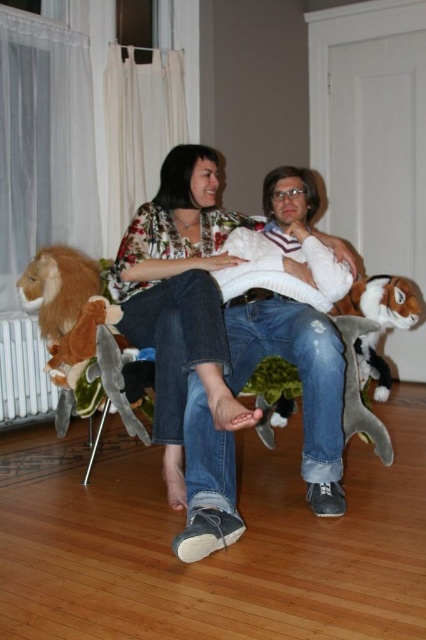
Is floral print blouse at center positioned at the back of white metallic radiator at lower left?

No, floral print blouse at center is in front of white metallic radiator at lower left.

You are a GUI agent. You are given a task and a screenshot of the screen. Output one action in this format:
    pyautogui.click(x=<x>, y=<y>)
    Task: Click on the floral print blouse at center
    The height and width of the screenshot is (640, 426).
    Given the screenshot: What is the action you would take?
    [181, 298]

Which is behind, point (204, 225) or point (20, 317)?

Positioned behind is point (20, 317).

Image resolution: width=426 pixels, height=640 pixels. In order to click on floral print blouse at center in this screenshot , I will do `click(181, 298)`.